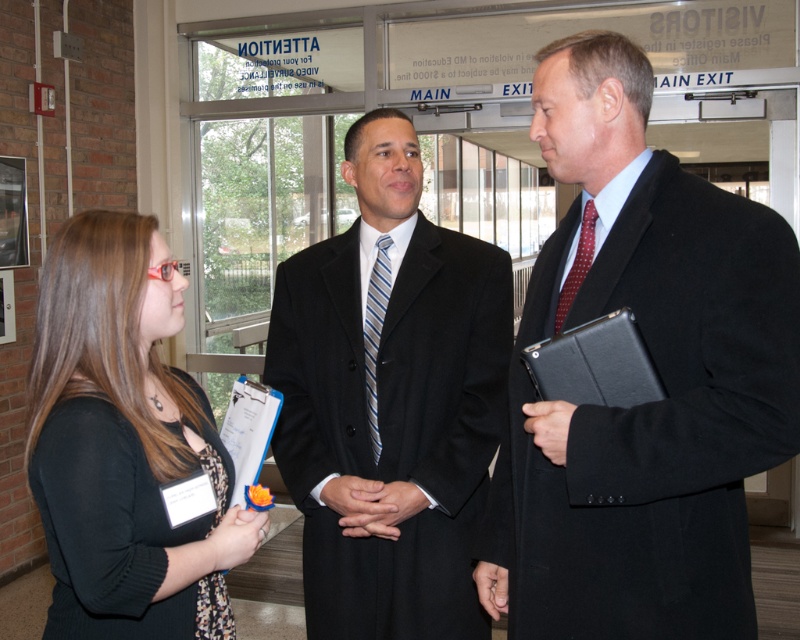
Is point (178, 285) positioned after point (381, 282)?

That is False.

Is the position of matte black dress at left less distant than that of blue striped tie at center?

Yes, it is in front of blue striped tie at center.

Between point (34, 442) and point (380, 246), which one is positioned behind?

The point (380, 246) is more distant.

The image size is (800, 640). In order to click on matte black dress at left in this screenshot , I will do [x=124, y=444].

Does blue striped tie at center appear over red dotted tie at center?

No, blue striped tie at center is not above red dotted tie at center.

Does point (368, 426) come farther from viewer compared to point (570, 269)?

Yes, it is.

You are a GUI agent. You are given a task and a screenshot of the screen. Output one action in this format:
    pyautogui.click(x=<x>, y=<y>)
    Task: Click on the blue striped tie at center
    The height and width of the screenshot is (640, 800).
    Given the screenshot: What is the action you would take?
    pyautogui.click(x=376, y=332)

Is black suit at center positioned before matte black dress at left?

No.

Looking at this image, can you confirm if black suit at center is thinner than matte black dress at left?

In fact, black suit at center might be wider than matte black dress at left.

Is point (362, 240) farther from camera compared to point (122, 403)?

Yes, point (362, 240) is farther from viewer.

I want to click on black suit at center, so click(389, 401).